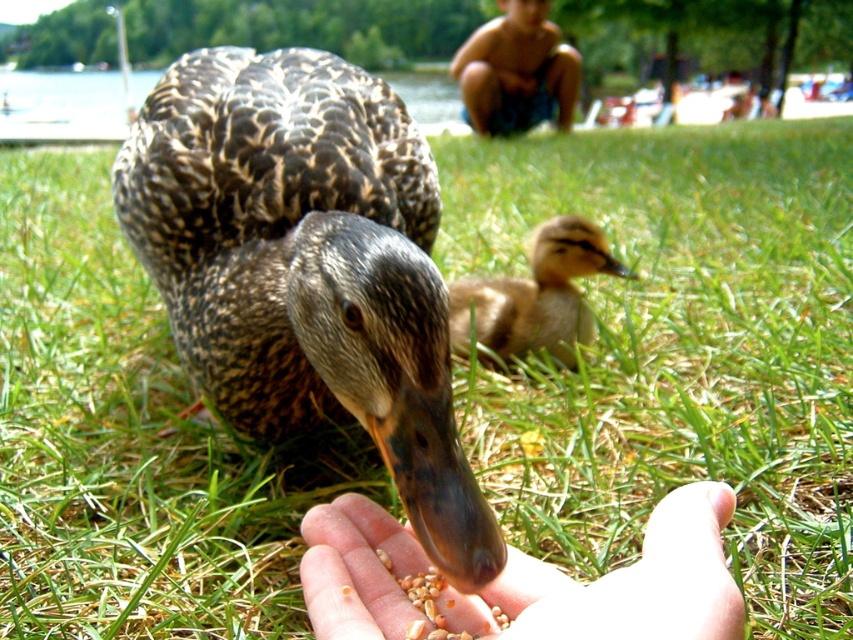
Between brown speckled duck at center and blurred skin boy at upper center, which one has less height?

Standing shorter between the two is brown speckled duck at center.

Can you confirm if brown speckled duck at center is thinner than blurred skin boy at upper center?

Yes.

Does point (172, 173) come farther from viewer compared to point (550, 72)?

No.

This screenshot has width=853, height=640. Identify the location of brown speckled duck at center. (306, 268).

Does skinny human hand at center have a larger size compared to brown downy duckling at center?

No, skinny human hand at center is not bigger than brown downy duckling at center.

Is skinny human hand at center positioned behind brown downy duckling at center?

That is False.

Who is more forward, (479,608) or (550,353)?

Point (479,608)

Find the location of `skinny human hand at center`. skinny human hand at center is located at coordinates (622, 582).

Between brown downy duckling at center and blurred skin boy at upper center, which one has less height?

Standing shorter between the two is brown downy duckling at center.

Does brown downy duckling at center have a larger size compared to blurred skin boy at upper center?

No.

Is point (468, 337) farther from viewer compared to point (548, 32)?

That is False.

At what (x,y) coordinates should I click in order to perform the action: click on brown downy duckling at center. Please return your answer as a coordinate pair (x, y). The width and height of the screenshot is (853, 640). Looking at the image, I should click on (534, 296).